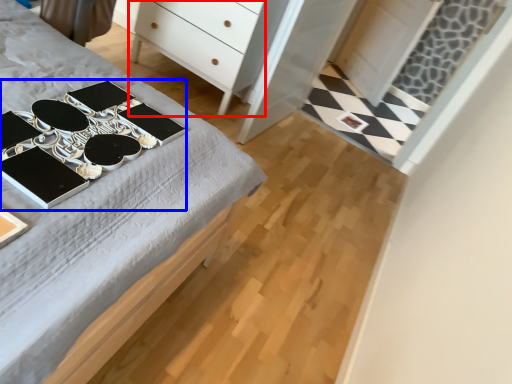
Question: Which of the following is the farthest to the observer, chest of drawers (highlighted by a red box) or changing table (highlighted by a blue box)?

Choices:
 (A) chest of drawers
 (B) changing table

Answer: (A)